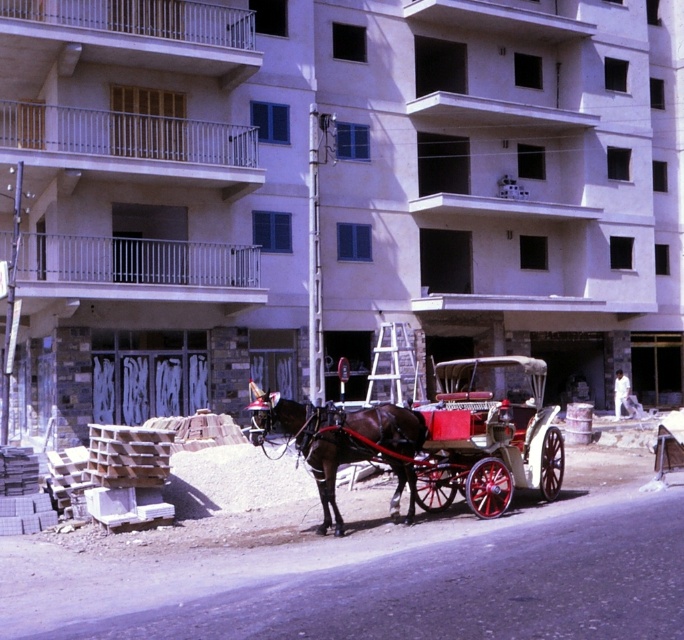
You are a delivery person trying to reach the shiny brown horse at center to give it some food. The polished wood horse cart at center is blocking your path. Can you walk around the cart to reach the horse?

The shiny brown horse at center is behind the polished wood horse cart at center, so you can walk around the cart to reach the horse.

Consider the image. You are a delivery person needing to load a small package onto the polished wood horse cart at center. Considering the size of the shiny brown horse at center, will the package fit on the cart?

The polished wood horse cart at center is larger in size than the shiny brown horse at center, so the package should fit on the cart since it is bigger than the horse.